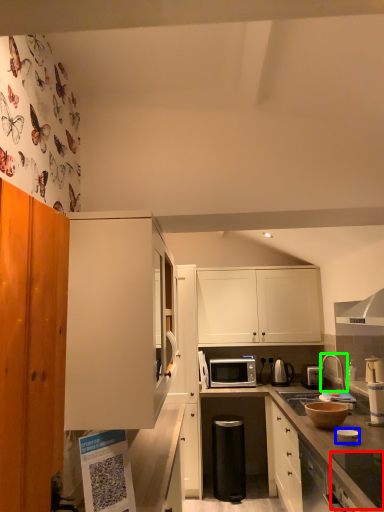
Question: Based on their relative distances, which object is nearer to appliance (highlighted by a red box)? Choose from appliance (highlighted by a blue box) and tap (highlighted by a green box).

Choices:
 (A) appliance
 (B) tap

Answer: (A)